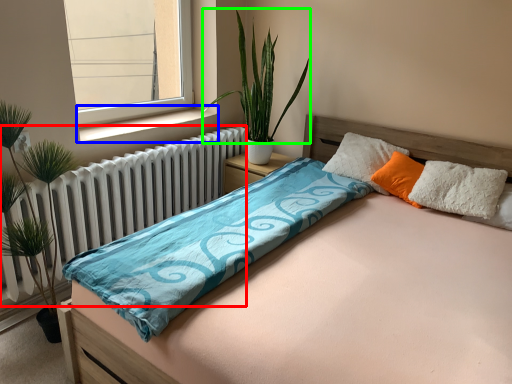
Question: Which object is positioned farthest from radiator (highlighted by a red box)? Select from window sill (highlighted by a blue box) and vegetation (highlighted by a green box).

Choices:
 (A) window sill
 (B) vegetation

Answer: (B)